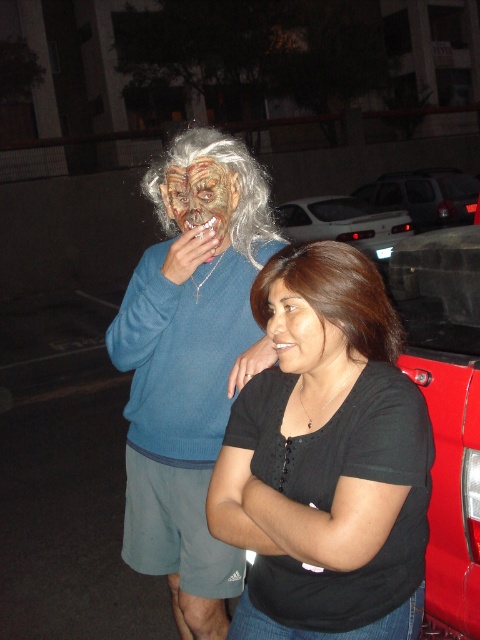
Question: Which point appears farthest from the camera in this image?

Choices:
 (A) (453, 500)
 (B) (240, 182)
 (C) (351, 301)

Answer: (B)

Question: Which of the following is the closest to the observer?

Choices:
 (A) (447, 195)
 (B) (373, 348)
 (C) (237, 342)

Answer: (B)

Question: Is red matte truck at right smaller than gray synthetic wig at upper center?

Choices:
 (A) yes
 (B) no

Answer: (A)

Question: Does matte blue sweater at center lie behind smooth skin face at center?

Choices:
 (A) no
 (B) yes

Answer: (B)

Question: Which point is farther to the camera?

Choices:
 (A) (437, 173)
 (B) (160, 168)

Answer: (A)

Question: Does matte blue sweater at center have a lesser width compared to red matte truck at right?

Choices:
 (A) no
 (B) yes

Answer: (A)